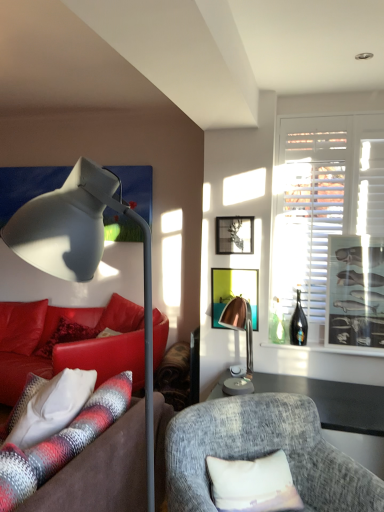
Describe the element at coordinates (298, 324) in the screenshot. The width and height of the screenshot is (384, 512). I see `black glass bottle at right` at that location.

In order to face black glass bottle at right, should I rotate leftwards or rightwards?

A 14.272 degree turn to the right will do.

This screenshot has width=384, height=512. What do you see at coordinates (355, 291) in the screenshot?
I see `metallic silver picture frame at right, which is the 3th picture frame in left-to-right order` at bounding box center [355, 291].

How much space does copper metallic lamp at center, positioned as the 2th lamp in front-to-back order, occupy horizontally?

copper metallic lamp at center, positioned as the 2th lamp in front-to-back order, is 10.34 inches in width.

Locate an element on the screen. This screenshot has height=512, width=384. black glass bottle at right is located at coordinates (298, 324).

Relative to white matte window at right, is plush brown couch at left, positioned as the 1th studio couch in front-to-back order, in front or behind?

plush brown couch at left, positioned as the 1th studio couch in front-to-back order, is positioned closer to the viewer than white matte window at right.

Between plush brown couch at left, arranged as the second studio couch when viewed from the back, and white matte window at right, which one has smaller size?

Smaller between the two is white matte window at right.

From the image's perspective, is plush brown couch at left, positioned as the 1th studio couch in front-to-back order, over white matte window at right?

Actually, plush brown couch at left, positioned as the 1th studio couch in front-to-back order, appears below white matte window at right in the image.

Is plush brown couch at left, arranged as the second studio couch when viewed from the back, in contact with white matte window at right?

They are not placed beside each other.

From the image's perspective, is copper metallic lamp at center, positioned as the 2th lamp in front-to-back order, above textured gray armchair at center?

Yes, from the image's perspective, copper metallic lamp at center, positioned as the 2th lamp in front-to-back order, is over textured gray armchair at center.

Can you confirm if copper metallic lamp at center, which is counted as the 1th lamp, starting from the back, is wider than textured gray armchair at center?

No.

Is copper metallic lamp at center, positioned as the 2th lamp in front-to-back order, further to camera compared to textured gray armchair at center?

Yes, the depth of copper metallic lamp at center, positioned as the 2th lamp in front-to-back order, is greater than that of textured gray armchair at center.

Which is farther, (245, 301) or (173, 419)?

The point (245, 301) is farther.

Is copper metallic lamp at center, which is counted as the first lamp, starting from the right, behind black glass bottle at right?

No, copper metallic lamp at center, which is counted as the first lamp, starting from the right, is in front of black glass bottle at right.

Is copper metallic lamp at center, the 2th lamp in the left-to-right sequence, at the right side of black glass bottle at right?

In fact, copper metallic lamp at center, the 2th lamp in the left-to-right sequence, is to the left of black glass bottle at right.

Looking at this image, who is taller, copper metallic lamp at center, which is counted as the 1th lamp, starting from the back, or black glass bottle at right?

With more height is copper metallic lamp at center, which is counted as the 1th lamp, starting from the back.

Is point (14, 433) less distant than point (103, 428)?

No, it is behind (103, 428).

From the picture: Is white textured pillow at lower left, which appears as the first pillow when viewed from the left, not within plush brown couch at left, positioned as the 1th studio couch in front-to-back order?

No, white textured pillow at lower left, which appears as the first pillow when viewed from the left, is not entirely external to plush brown couch at left, positioned as the 1th studio couch in front-to-back order.

From a real-world perspective, is white textured pillow at lower left, positioned as the 2th pillow in front-to-back order, physically above plush brown couch at left, arranged as the second studio couch when viewed from the back?

No, from a real-world perspective, white textured pillow at lower left, positioned as the 2th pillow in front-to-back order, is not on top of plush brown couch at left, arranged as the second studio couch when viewed from the back.

Locate an element on the screen. The width and height of the screenshot is (384, 512). studio couch in front of the white textured pillow at lower left, positioned as the 2th pillow in front-to-back order is located at coordinates 64,443.

Does metallic silver picture frame at right, which is the first picture frame in right-to-left order, touch white matte window at right?

No, metallic silver picture frame at right, which is the first picture frame in right-to-left order, is not with white matte window at right.

In the image, is metallic silver picture frame at right, which is the first picture frame in right-to-left order, on the left side or the right side of white matte window at right?

metallic silver picture frame at right, which is the first picture frame in right-to-left order, is positioned on white matte window at right's right side.

What's the angular difference between metallic silver picture frame at right, which is the 3th picture frame in left-to-right order, and white matte window at right's facing directions?

metallic silver picture frame at right, which is the 3th picture frame in left-to-right order, and white matte window at right are facing 0.439 degrees away from each other.

Could you tell me if metallic silver picture frame at right, which is the 3th picture frame in left-to-right order, is facing white matte window at right?

No, metallic silver picture frame at right, which is the 3th picture frame in left-to-right order, is not oriented towards white matte window at right.

Are matte green picture frame at center, which ranks as the second picture frame in left-to-right order, and copper metallic lamp at center, positioned as the 2th lamp in front-to-back order, located far from each other?

No, matte green picture frame at center, which ranks as the second picture frame in left-to-right order, is in close proximity to copper metallic lamp at center, positioned as the 2th lamp in front-to-back order.

Which is more to the right, matte green picture frame at center, which ranks as the second picture frame in left-to-right order, or copper metallic lamp at center, positioned as the 2th lamp in front-to-back order?

Positioned to the right is matte green picture frame at center, which ranks as the second picture frame in left-to-right order.

Between matte green picture frame at center, which ranks as the second picture frame in left-to-right order, and copper metallic lamp at center, the 2th lamp in the left-to-right sequence, which one has smaller size?

Smaller between the two is matte green picture frame at center, which ranks as the second picture frame in left-to-right order.

From the image's perspective, who appears lower, matte green picture frame at center, which is the 2th picture frame from right to left, or copper metallic lamp at center, which is counted as the first lamp, starting from the right?

copper metallic lamp at center, which is counted as the first lamp, starting from the right, is shown below in the image.

Considering the sizes of white matte window at right and white fabric pillow at lower center, positioned as the 1th pillow in front-to-back order, in the image, is white matte window at right taller or shorter than white fabric pillow at lower center, positioned as the 1th pillow in front-to-back order,?

In the image, white matte window at right appears to be taller than white fabric pillow at lower center, positioned as the 1th pillow in front-to-back order.

Is white matte window at right aimed at white fabric pillow at lower center, the first pillow when ordered from right to left?

Yes, white matte window at right faces towards white fabric pillow at lower center, the first pillow when ordered from right to left.

Is white matte window at right far away from white fabric pillow at lower center, the first pillow when ordered from right to left?

Yes, white matte window at right and white fabric pillow at lower center, the first pillow when ordered from right to left, are quite far apart.

Locate an element on the screen. Image resolution: width=384 pixels, height=512 pixels. window behind the white fabric pillow at lower center, placed as the second pillow when sorted from left to right is located at coordinates (320, 206).

The height and width of the screenshot is (512, 384). What are the coordinates of `studio couch in front of the white matte window at right` in the screenshot? It's located at (64, 443).

Find the location of a particular element. The height and width of the screenshot is (512, 384). chair located on the right of copper metallic lamp at center, which is counted as the 1th lamp, starting from the back is located at coordinates (264, 452).

Based on their spatial positions, is matte green picture frame at center, which is the 2th picture frame from right to left, or leather couch at left, the first studio couch from the back, further from black glass bottle at right?

The object further to black glass bottle at right is leather couch at left, the first studio couch from the back.

Based on their spatial positions, is matte green picture frame at center, which ranks as the second picture frame in left-to-right order, or clear glass bottle at right closer to metallic silver picture frame at right, which is the first picture frame in right-to-left order?

clear glass bottle at right is positioned closer to the anchor metallic silver picture frame at right, which is the first picture frame in right-to-left order.

When comparing their distances from metallic silver picture frame at upper center, marked as the first picture frame in a left-to-right arrangement, does leather couch at left, the second studio couch viewed from the front, or white matte window at right seem further?

leather couch at left, the second studio couch viewed from the front, lies further to metallic silver picture frame at upper center, marked as the first picture frame in a left-to-right arrangement, than the other object.

When comparing their distances from metallic silver picture frame at right, which is the 3th picture frame in left-to-right order, does plush brown couch at left, positioned as the 1th studio couch in front-to-back order, or white fabric pillow at lower center, the first pillow when ordered from right to left, seem closer?

white fabric pillow at lower center, the first pillow when ordered from right to left, is positioned closer to the anchor metallic silver picture frame at right, which is the 3th picture frame in left-to-right order.

Considering their positions, is white matte window at right positioned closer to clear glass bottle at right than matte gray floor lamp at left, which is the first lamp from front to back?

white matte window at right is closer to clear glass bottle at right.

From the image, which object appears to be farther from white fabric pillow at lower center, positioned as the 1th pillow in front-to-back order, textured gray armchair at center or white matte window at right?

Based on the image, white matte window at right appears to be further to white fabric pillow at lower center, positioned as the 1th pillow in front-to-back order.

From the image, which object appears to be farther from white textured pillow at lower left, the 2th pillow from the right, copper metallic lamp at center, positioned as the 2th lamp in front-to-back order, or leather couch at left, the second studio couch viewed from the front?

leather couch at left, the second studio couch viewed from the front.

From the image, which object appears to be nearer to leather couch at left, the first studio couch from the back, textured gray armchair at center or matte green picture frame at center, which ranks as the second picture frame in left-to-right order?

matte green picture frame at center, which ranks as the second picture frame in left-to-right order, is closer to leather couch at left, the first studio couch from the back.

Locate an element on the screen. window sill positioned between textured gray armchair at center and matte green picture frame at center, which is the 2th picture frame from right to left, from near to far is located at coordinates (329, 349).

Locate an element on the screen. window sill positioned between matte gray floor lamp at left, which is the 2th lamp from back to front, and black glass bottle at right from near to far is located at coordinates (329, 349).

Find the location of a particular element. The image size is (384, 512). window sill between textured gray armchair at center and black glass bottle at right along the z-axis is located at coordinates (329, 349).

Locate an element on the screen. lamp between textured gray armchair at center and black glass bottle at right from front to back is located at coordinates (246, 342).